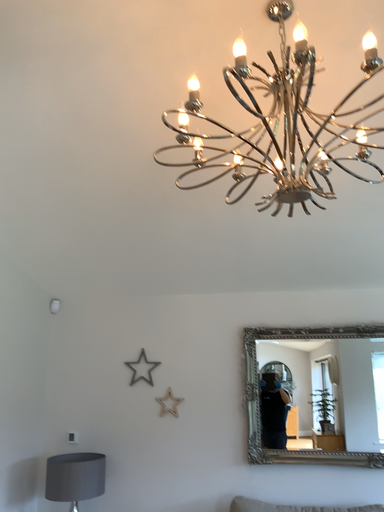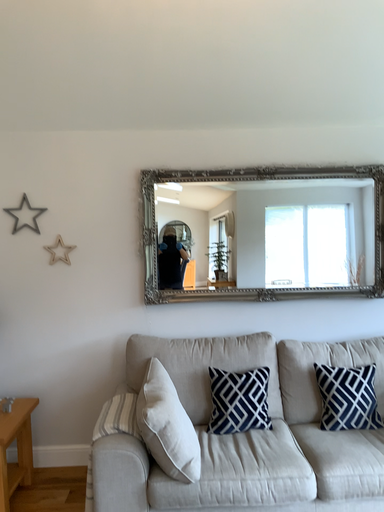
Question: Which way did the camera rotate in the video?

Choices:
 (A) rotated downward
 (B) rotated upward

Answer: (A)